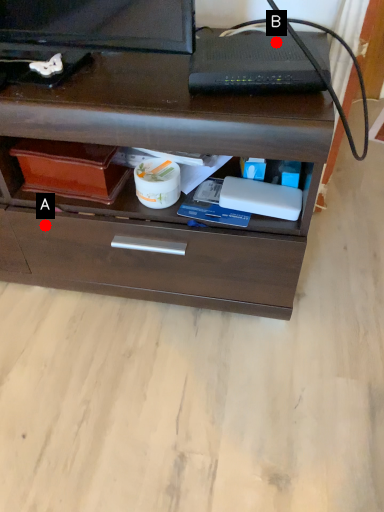
Question: Two points are circled on the image, labeled by A and B beside each circle. Which point appears closest to the camera in this image?

Choices:
 (A) A is closer
 (B) B is closer

Answer: (B)